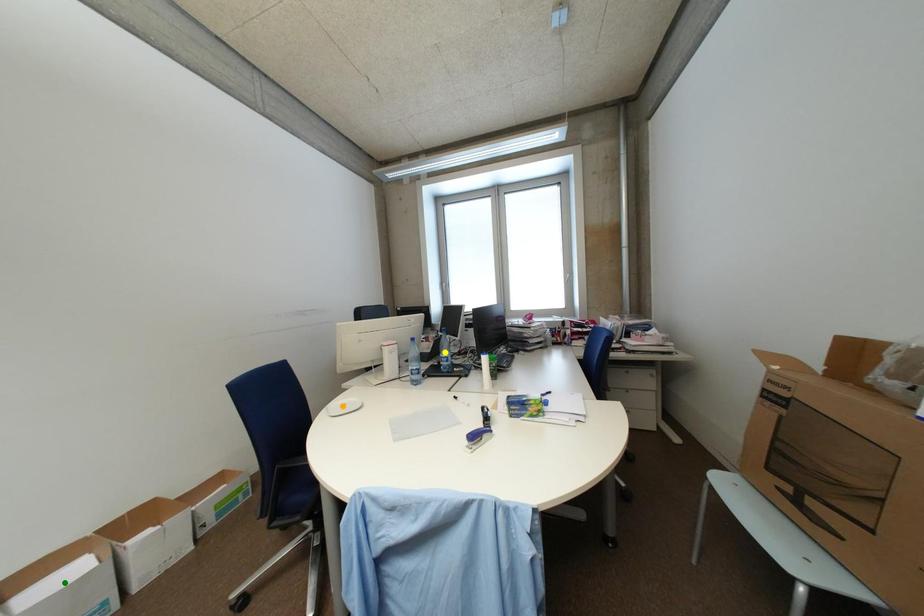
Order these from nearest to farthest:
yellow point
green point
orange point

green point, orange point, yellow point